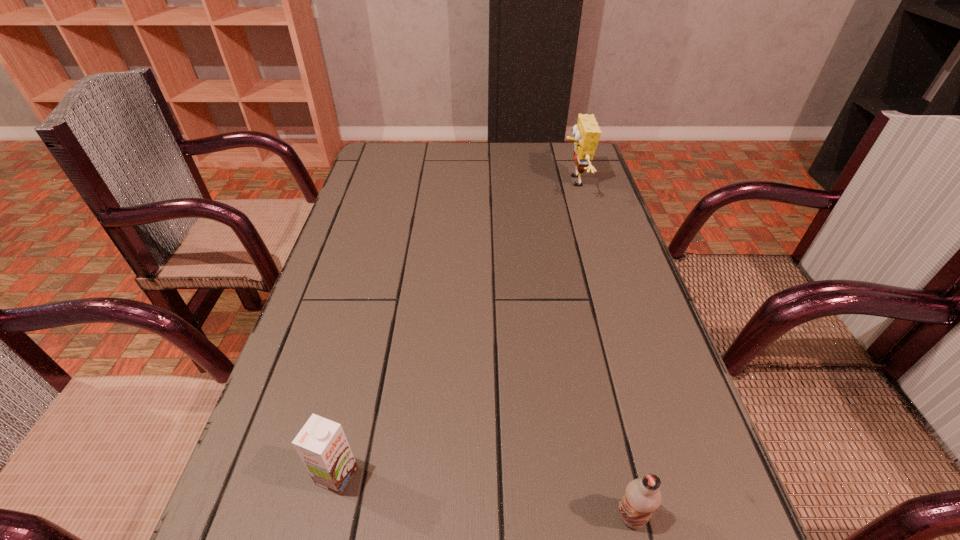
This screenshot has width=960, height=540. I want to click on the farthest object, so click(x=586, y=132).

Image resolution: width=960 pixels, height=540 pixels. In order to click on sponge in this screenshot , I will do `click(586, 132)`.

Where is `the second farthest object`? the second farthest object is located at coordinates (321, 444).

Locate an element on the screen. The width and height of the screenshot is (960, 540). the farther chocolate milk is located at coordinates (321, 444).

Identify the location of the nearest object. (642, 497).

Locate an element on the screen. Image resolution: width=960 pixels, height=540 pixels. the right chocolate milk is located at coordinates (642, 497).

Where is `vacant space located on the face of the tallest object`? Image resolution: width=960 pixels, height=540 pixels. vacant space located on the face of the tallest object is located at coordinates (493, 181).

Where is `vacant space located on the face of the tallest object`? The image size is (960, 540). vacant space located on the face of the tallest object is located at coordinates (523, 181).

Where is `free space located on the face of the tallest object`? The image size is (960, 540). free space located on the face of the tallest object is located at coordinates (516, 181).

Locate an element on the screen. This screenshot has width=960, height=540. free space located 0.110m on the right of the leftmost object is located at coordinates (428, 476).